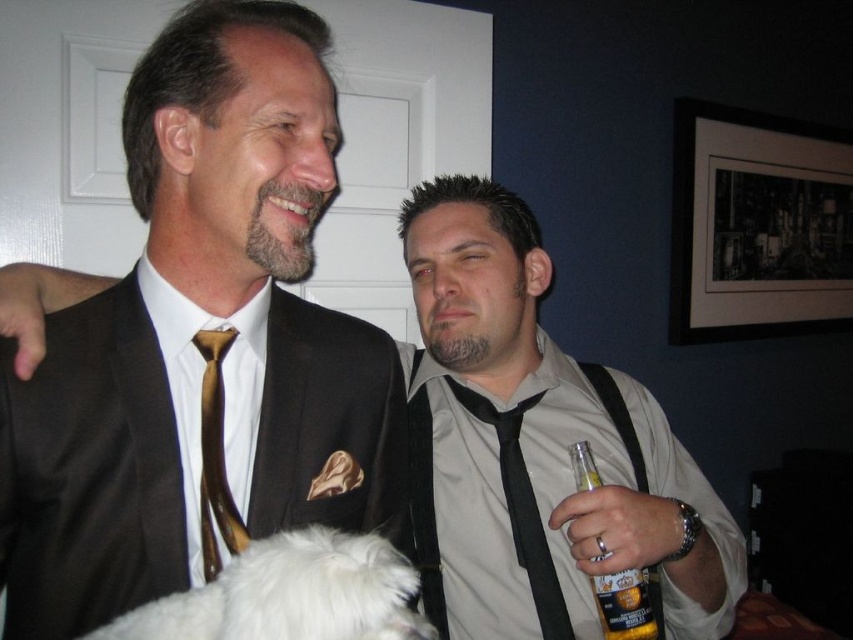
Question: Can you confirm if matte black shirt at center is bigger than translucent glass beer bottle at right?

Choices:
 (A) yes
 (B) no

Answer: (A)

Question: Estimate the real-world distances between objects in this image. Which object is closer to the white fluffy dog at lower left?

Choices:
 (A) matte black suit at center
 (B) black satin tie at center

Answer: (A)

Question: Among these objects, which one is farthest from the camera?

Choices:
 (A) matte black suit at center
 (B) translucent glass beer bottle at right

Answer: (B)

Question: Which object is the farthest from the black satin tie at center?

Choices:
 (A) white fluffy dog at lower left
 (B) matte black suit at center
 (C) translucent glass beer bottle at right
 (D) matte black shirt at center

Answer: (A)

Question: Is matte black suit at center smaller than translucent glass beer bottle at right?

Choices:
 (A) no
 (B) yes

Answer: (A)

Question: Can you confirm if matte black suit at center is thinner than matte black shirt at center?

Choices:
 (A) yes
 (B) no

Answer: (A)